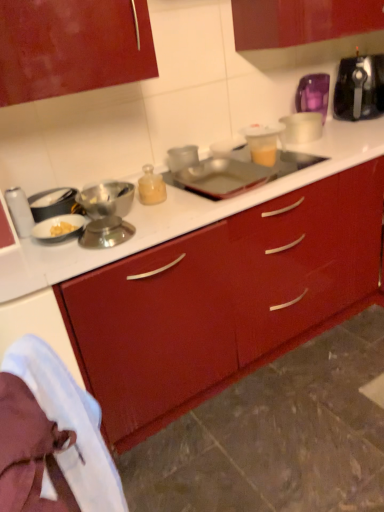
This screenshot has width=384, height=512. Find the location of `free space to the right of translucent plastic cup at upper center, arranged as the second appliance when viewed from the right`. free space to the right of translucent plastic cup at upper center, arranged as the second appliance when viewed from the right is located at coordinates (304, 161).